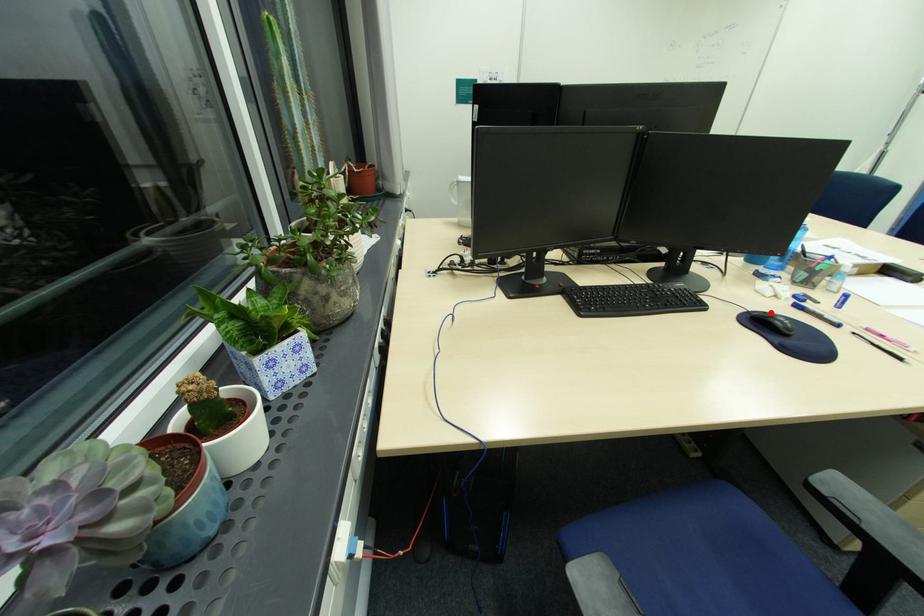
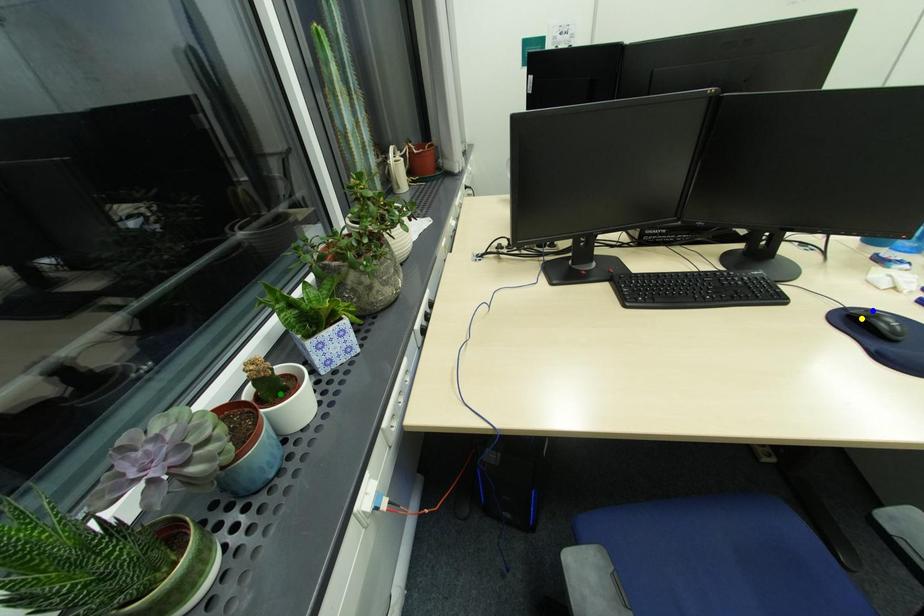
Question: I am providing you with two images of the same scene from different viewpoints. A red point is marked on the first image. You are given multiple points on the second image. Which point in image 2 is actually the same real-world point as the red point in image 1?

Choices:
 (A) blue point
 (B) yellow point
 (C) green point

Answer: (A)